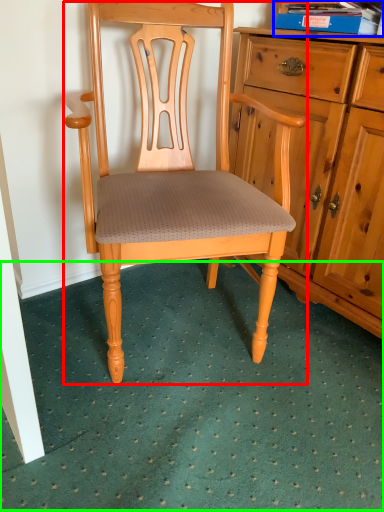
Question: Which is nearer to the chair (highlighted by a red box)? book (highlighted by a blue box) or doormat (highlighted by a green box).

Choices:
 (A) book
 (B) doormat

Answer: (B)